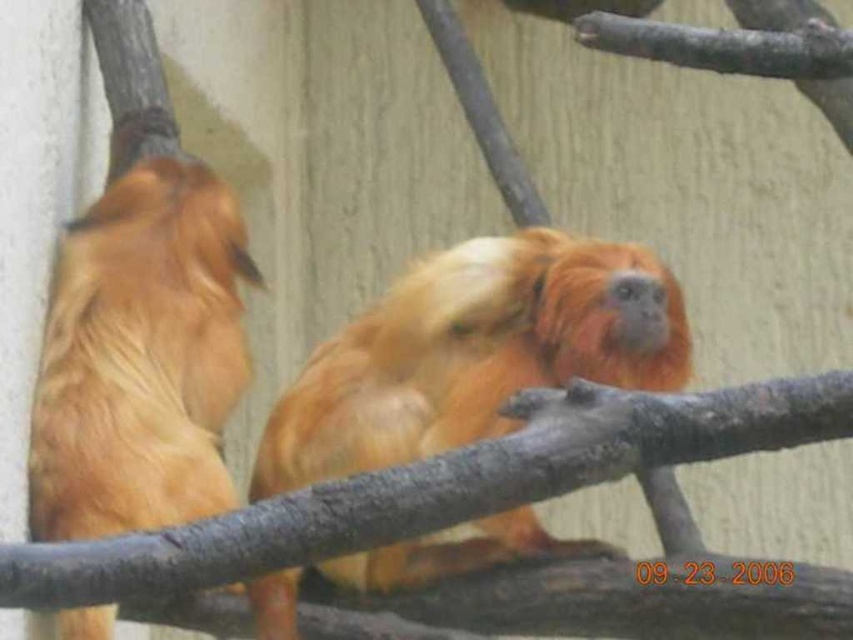
Question: Among these points, which one is farthest from the camera?

Choices:
 (A) (119, 161)
 (B) (599, 324)

Answer: (A)

Question: Is golden fur monkey at center behind golden fur monkey at left?

Choices:
 (A) no
 (B) yes

Answer: (B)

Question: Can you confirm if golden fur monkey at center is positioned to the right of golden fur monkey at left?

Choices:
 (A) yes
 (B) no

Answer: (A)

Question: Which point appears closest to the camera in this image?

Choices:
 (A) (589, 342)
 (B) (91, 353)

Answer: (A)

Question: Among these points, which one is farthest from the camera?

Choices:
 (A) (387, 545)
 (B) (136, 252)

Answer: (B)

Question: Is golden fur monkey at center behind golden fur monkey at left?

Choices:
 (A) yes
 (B) no

Answer: (A)